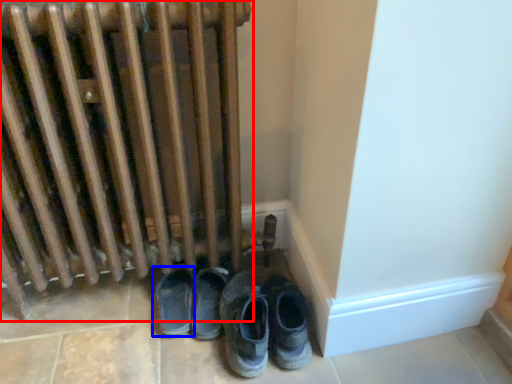
Question: Which object appears closest to the camera in this image, radiator (highlighted by a red box) or footwear (highlighted by a blue box)?

Choices:
 (A) radiator
 (B) footwear

Answer: (A)